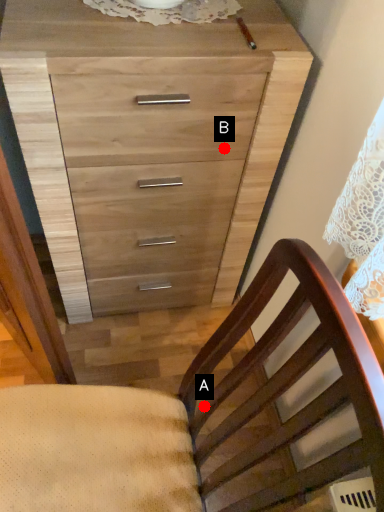
Question: Two points are circled on the image, labeled by A and B beside each circle. Which point is farther from the camera taking this photo?

Choices:
 (A) A is further
 (B) B is further

Answer: (B)